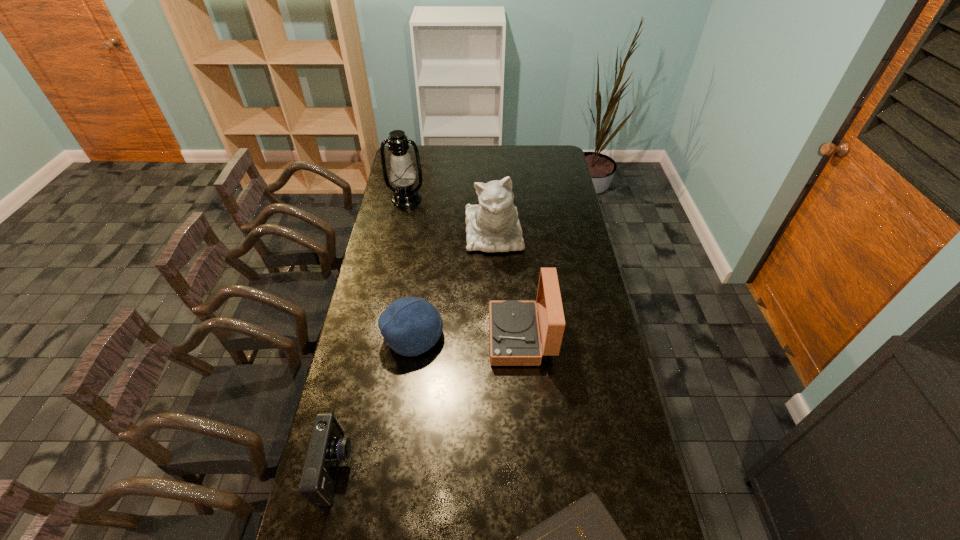
Locate an element on the screen. vacant area that lies between the farthest object and the phonograph record is located at coordinates (464, 268).

At what (x,y) coordinates should I click in order to perform the action: click on free space between the skullcap and the oil lamp. Please return your answer as a coordinate pair (x, y). Image resolution: width=960 pixels, height=540 pixels. Looking at the image, I should click on (410, 267).

I want to click on free space between the fourth shortest object and the skullcap, so click(468, 336).

Where is `free point between the cat and the oil lamp`? Image resolution: width=960 pixels, height=540 pixels. free point between the cat and the oil lamp is located at coordinates (450, 216).

Identify the location of object that is the fourth closest one to the cat. The width and height of the screenshot is (960, 540). (327, 447).

Locate which object is the fourth closest to the second farthest object. Please provide its 2D coordinates. Your answer should be formatted as a tuple, i.e. [(x, y)], where the tuple contains the x and y coordinates of a point satisfying the conditions above.

[(327, 447)]

What are the coordinates of `free space that satisfies the following two spatial constraints: 1. on the front side of the skullcap; 2. on the front-facing side of the fifth tallest object` in the screenshot? It's located at (396, 469).

Locate an element on the screen. This screenshot has width=960, height=540. free spot that satisfies the following two spatial constraints: 1. on the front side of the skullcap; 2. on the front-facing side of the fifth tallest object is located at coordinates (396, 469).